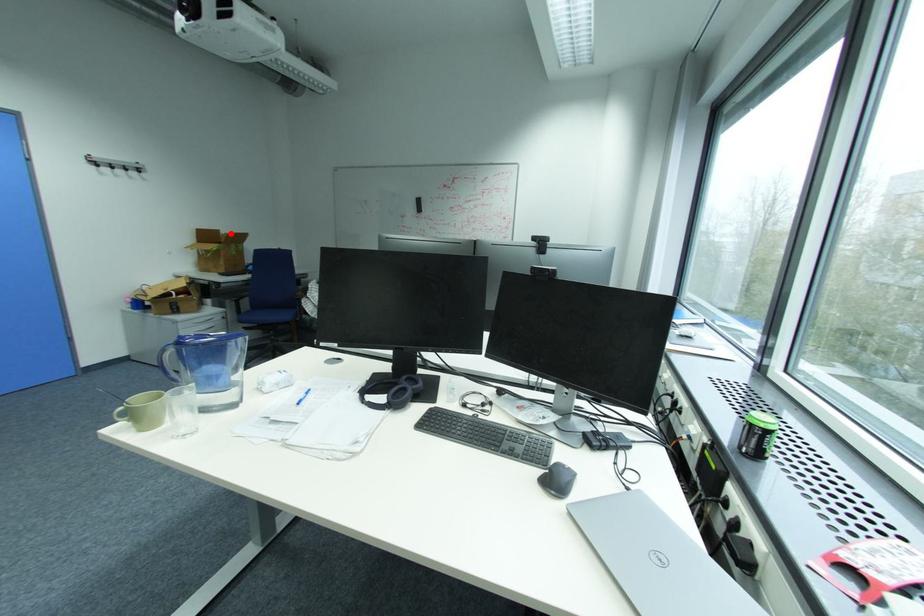
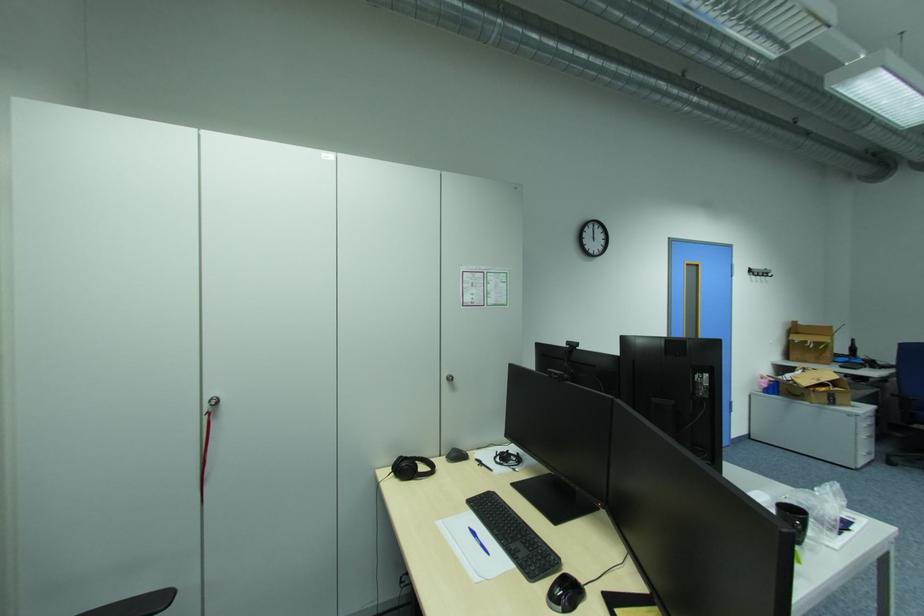
Locate, in the second image, the point that corresponds to the highlighted location in the first image.

(808, 323)